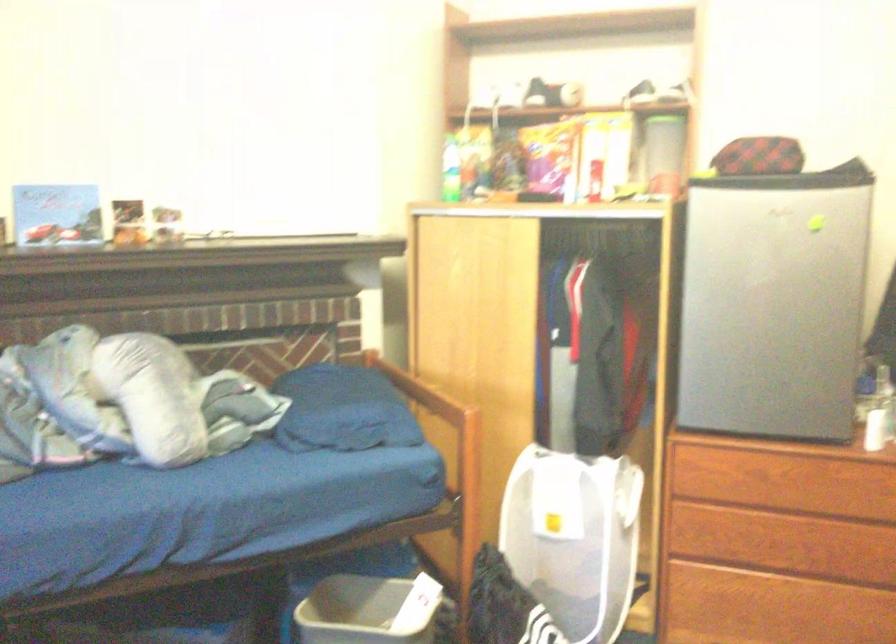
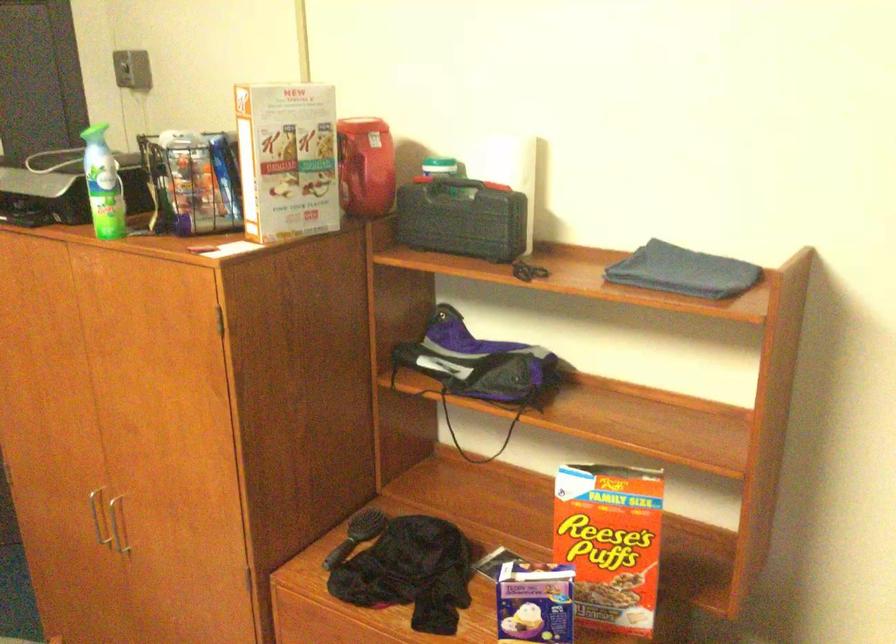
Question: Based on the continuous images, in which direction is the camera rotating? Reply with the corresponding letter.

Choices:
 (A) Left
 (B) Right
 (C) Up
 (D) Down

Answer: (B)